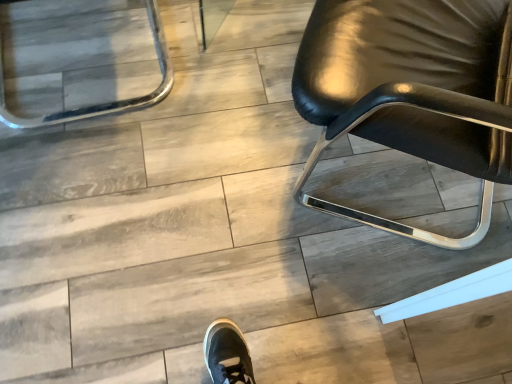
Question: Does clear glass tray at upper left, which is the first chair from left to right, lie in front of glossy black chair at right, the 2th chair in the left-to-right sequence?

Choices:
 (A) no
 (B) yes

Answer: (A)

Question: Considering the relative sizes of clear glass tray at upper left, placed as the 2th chair when sorted from right to left, and glossy black chair at right, the 2th chair in the left-to-right sequence, in the image provided, is clear glass tray at upper left, placed as the 2th chair when sorted from right to left, smaller than glossy black chair at right, the 2th chair in the left-to-right sequence,?

Choices:
 (A) yes
 (B) no

Answer: (A)

Question: Is clear glass tray at upper left, which is the first chair from left to right, aimed at glossy black chair at right, which is counted as the first chair, starting from the right?

Choices:
 (A) yes
 (B) no

Answer: (B)

Question: Can you confirm if clear glass tray at upper left, placed as the 2th chair when sorted from right to left, is shorter than glossy black chair at right, the 2th chair in the left-to-right sequence?

Choices:
 (A) no
 (B) yes

Answer: (B)

Question: Is clear glass tray at upper left, which is the first chair from left to right, to the left of glossy black chair at right, which is counted as the first chair, starting from the right, from the viewer's perspective?

Choices:
 (A) no
 (B) yes

Answer: (B)

Question: Is clear glass tray at upper left, which is the first chair from left to right, at the right side of glossy black chair at right, the 2th chair in the left-to-right sequence?

Choices:
 (A) no
 (B) yes

Answer: (A)

Question: Can you confirm if glossy black chair at right, which is counted as the first chair, starting from the right, is thinner than clear glass tray at upper left, placed as the 2th chair when sorted from right to left?

Choices:
 (A) no
 (B) yes

Answer: (A)

Question: Does glossy black chair at right, the 2th chair in the left-to-right sequence, have a lesser height compared to clear glass tray at upper left, placed as the 2th chair when sorted from right to left?

Choices:
 (A) no
 (B) yes

Answer: (A)

Question: Is glossy black chair at right, the 2th chair in the left-to-right sequence, behind clear glass tray at upper left, placed as the 2th chair when sorted from right to left?

Choices:
 (A) no
 (B) yes

Answer: (A)

Question: Is glossy black chair at right, which is counted as the first chair, starting from the right, in front of clear glass tray at upper left, placed as the 2th chair when sorted from right to left?

Choices:
 (A) no
 (B) yes

Answer: (B)

Question: From a real-world perspective, is glossy black chair at right, the 2th chair in the left-to-right sequence, on clear glass tray at upper left, placed as the 2th chair when sorted from right to left?

Choices:
 (A) no
 (B) yes

Answer: (B)

Question: Is glossy black chair at right, which is counted as the first chair, starting from the right, bigger than clear glass tray at upper left, which is the first chair from left to right?

Choices:
 (A) no
 (B) yes

Answer: (B)

Question: In terms of width, does clear glass tray at upper left, placed as the 2th chair when sorted from right to left, look wider or thinner when compared to glossy black chair at right, which is counted as the first chair, starting from the right?

Choices:
 (A) wide
 (B) thin

Answer: (B)